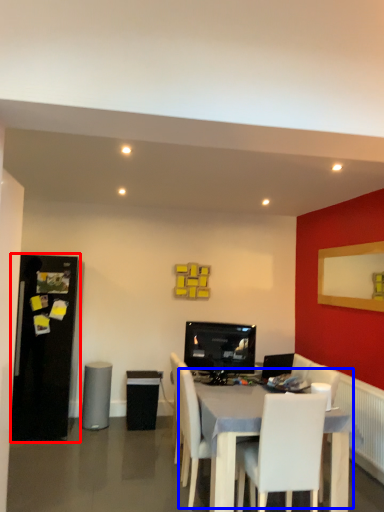
Question: Which object is closer to the camera taking this photo, fridge (highlighted by a red box) or table (highlighted by a blue box)?

Choices:
 (A) fridge
 (B) table

Answer: (B)